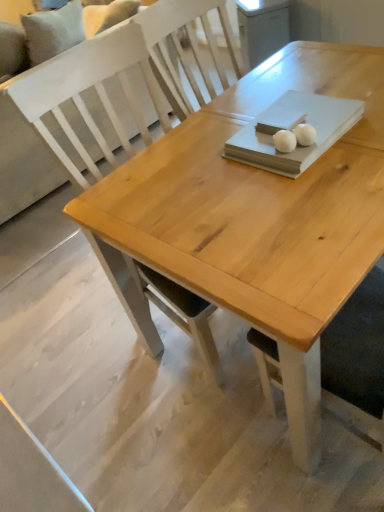
You are a GUI agent. You are given a task and a screenshot of the screen. Output one action in this format:
    pyautogui.click(x=<x>, y=<y>)
    Task: Click on the natural wood table at center
    This screenshot has height=512, width=384.
    Given the screenshot: What is the action you would take?
    pyautogui.click(x=255, y=220)

The image size is (384, 512). Describe the element at coordinates (284, 141) in the screenshot. I see `white matte ball at center, the second food viewed from the right` at that location.

Locate an element on the screen. The height and width of the screenshot is (512, 384). white glossy egg at upper center, arranged as the second food when viewed from the left is located at coordinates (305, 134).

From a real-world perspective, is white fabric couch at upper left physically located above or below white matte ball at center, which is the 1th food in left-to-right order?

white fabric couch at upper left is below white matte ball at center, which is the 1th food in left-to-right order.

Which is more to the right, white fabric couch at upper left or white matte ball at center, which is the 1th food in left-to-right order?

white matte ball at center, which is the 1th food in left-to-right order, is more to the right.

How different are the orientations of white fabric couch at upper left and white matte ball at center, the second food viewed from the right, in degrees?

There is a 23-degree angle between the facing directions of white fabric couch at upper left and white matte ball at center, the second food viewed from the right.

Can you confirm if white fabric couch at upper left is taller than white matte ball at center, the second food viewed from the right?

Correct, white fabric couch at upper left is much taller as white matte ball at center, the second food viewed from the right.

Locate an element on the screen. Image resolution: width=384 pixels, height=512 pixels. couch on the left of white glossy egg at upper center, arranged as the 1th food when viewed from the right is located at coordinates (22, 163).

Would you say white fabric couch at upper left is part of white glossy egg at upper center, arranged as the second food when viewed from the left,'s contents?

No, white glossy egg at upper center, arranged as the second food when viewed from the left, does not contain white fabric couch at upper left.

Can you confirm if white glossy egg at upper center, arranged as the second food when viewed from the left, is positioned to the left of white fabric couch at upper left?

No, white glossy egg at upper center, arranged as the second food when viewed from the left, is not to the left of white fabric couch at upper left.

Between white glossy egg at upper center, arranged as the 1th food when viewed from the right, and white fabric couch at upper left, which one is positioned behind?

white fabric couch at upper left is behind.

Identify the location of table above the white glossy egg at upper center, arranged as the second food when viewed from the left (from the image's perspective). The width and height of the screenshot is (384, 512). (255, 220).

What's the angular difference between white glossy egg at upper center, arranged as the second food when viewed from the left, and natural wood table at center's facing directions?

23.1 degrees separate the facing orientations of white glossy egg at upper center, arranged as the second food when viewed from the left, and natural wood table at center.

Do you think white glossy egg at upper center, arranged as the 1th food when viewed from the right, is within natural wood table at center, or outside of it?

white glossy egg at upper center, arranged as the 1th food when viewed from the right, is outside natural wood table at center.

Is white glossy egg at upper center, arranged as the second food when viewed from the left, positioned with its back to natural wood table at center?

white glossy egg at upper center, arranged as the second food when viewed from the left, does not have its back to natural wood table at center.

Locate an element on the screen. The height and width of the screenshot is (512, 384). couch behind the natural wood table at center is located at coordinates (22, 163).

Which is more to the right, white fabric couch at upper left or natural wood table at center?

natural wood table at center.

Does white fabric couch at upper left have a greater height compared to natural wood table at center?

Yes, white fabric couch at upper left is taller than natural wood table at center.

Considering the relative sizes of white matte ball at center, which is the 1th food in left-to-right order, and white fabric couch at upper left in the image provided, is white matte ball at center, which is the 1th food in left-to-right order, taller than white fabric couch at upper left?

In fact, white matte ball at center, which is the 1th food in left-to-right order, may be shorter than white fabric couch at upper left.

Is point (286, 148) less distant than point (55, 130)?

Yes.

Is white matte ball at center, which is the 1th food in left-to-right order, bigger than white fabric couch at upper left?

Incorrect, white matte ball at center, which is the 1th food in left-to-right order, is not larger than white fabric couch at upper left.

In the scene shown: Is white matte ball at center, the second food viewed from the right, inside the boundaries of white fabric couch at upper left, or outside?

white matte ball at center, the second food viewed from the right, exists outside the volume of white fabric couch at upper left.

How many degrees apart are the facing directions of natural wood table at center and white matte ball at center, the second food viewed from the right?

The facing directions of natural wood table at center and white matte ball at center, the second food viewed from the right, are 23.1 degrees apart.

Considering the relative sizes of natural wood table at center and white matte ball at center, which is the 1th food in left-to-right order, in the image provided, is natural wood table at center shorter than white matte ball at center, which is the 1th food in left-to-right order,?

In fact, natural wood table at center may be taller than white matte ball at center, which is the 1th food in left-to-right order.

From the image's perspective, who appears lower, natural wood table at center or white matte ball at center, which is the 1th food in left-to-right order?

white matte ball at center, which is the 1th food in left-to-right order.

Considering the sizes of objects natural wood table at center and white matte ball at center, which is the 1th food in left-to-right order, in the image provided, who is smaller, natural wood table at center or white matte ball at center, which is the 1th food in left-to-right order,?

With smaller size is white matte ball at center, which is the 1th food in left-to-right order.

Is white matte ball at center, the second food viewed from the right, surrounding natural wood table at center?

Definitely not — natural wood table at center is not inside white matte ball at center, the second food viewed from the right.

Is point (280, 138) behind point (299, 305)?

Yes, it is.

Does white matte ball at center, which is the 1th food in left-to-right order, turn towards natural wood table at center?

No, white matte ball at center, which is the 1th food in left-to-right order, is not turned towards natural wood table at center.

At what (x,y) coordinates should I click in order to perform the action: click on the 2nd food located above the white fabric couch at upper left (from a real-world perspective). Please return your answer as a coordinate pair (x, y). Looking at the image, I should click on (284, 141).

Find the location of a particular element. This screenshot has width=384, height=512. couch above the white glossy egg at upper center, arranged as the second food when viewed from the left (from the image's perspective) is located at coordinates (22, 163).

Estimate the real-world distances between objects in this image. Which object is closer to white matte ball at center, the second food viewed from the right, white fabric couch at upper left or white glossy egg at upper center, arranged as the second food when viewed from the left?

white glossy egg at upper center, arranged as the second food when viewed from the left, is closer to white matte ball at center, the second food viewed from the right.

Consider the image. Looking at the image, which one is located closer to white matte ball at center, the second food viewed from the right, natural wood table at center or white glossy egg at upper center, arranged as the 1th food when viewed from the right?

white glossy egg at upper center, arranged as the 1th food when viewed from the right, lies closer to white matte ball at center, the second food viewed from the right, than the other object.

From the image, which object appears to be farther from natural wood table at center, white matte ball at center, which is the 1th food in left-to-right order, or white fabric couch at upper left?

Based on the image, white fabric couch at upper left appears to be further to natural wood table at center.

Considering their positions, is white matte ball at center, the second food viewed from the right, positioned closer to white fabric couch at upper left than natural wood table at center?

Among the two, natural wood table at center is located nearer to white fabric couch at upper left.

Estimate the real-world distances between objects in this image. Which object is closer to white matte ball at center, which is the 1th food in left-to-right order, white glossy egg at upper center, arranged as the 1th food when viewed from the right, or white fabric couch at upper left?

white glossy egg at upper center, arranged as the 1th food when viewed from the right.

From the image, which object appears to be farther from white matte ball at center, which is the 1th food in left-to-right order, white glossy egg at upper center, arranged as the second food when viewed from the left, or natural wood table at center?

natural wood table at center.

When comparing their distances from white glossy egg at upper center, arranged as the 1th food when viewed from the right, does white fabric couch at upper left or natural wood table at center seem further?

Among the two, white fabric couch at upper left is located further to white glossy egg at upper center, arranged as the 1th food when viewed from the right.

When comparing their distances from natural wood table at center, does white glossy egg at upper center, arranged as the second food when viewed from the left, or white fabric couch at upper left seem closer?

white glossy egg at upper center, arranged as the second food when viewed from the left, lies closer to natural wood table at center than the other object.

Where is `table located between white fabric couch at upper left and white glossy egg at upper center, arranged as the second food when viewed from the left, in the left-right direction`? table located between white fabric couch at upper left and white glossy egg at upper center, arranged as the second food when viewed from the left, in the left-right direction is located at coordinates (255, 220).

Image resolution: width=384 pixels, height=512 pixels. Find the location of `food between natural wood table at center and white glossy egg at upper center, arranged as the 1th food when viewed from the right, in the horizontal direction`. food between natural wood table at center and white glossy egg at upper center, arranged as the 1th food when viewed from the right, in the horizontal direction is located at coordinates (284, 141).

Where is `table between white fabric couch at upper left and white matte ball at center, which is the 1th food in left-to-right order`? Image resolution: width=384 pixels, height=512 pixels. table between white fabric couch at upper left and white matte ball at center, which is the 1th food in left-to-right order is located at coordinates (255, 220).

You are a GUI agent. You are given a task and a screenshot of the screen. Output one action in this format:
    pyautogui.click(x=<x>, y=<y>)
    Task: Click on the food between white fabric couch at upper left and white glossy egg at upper center, arranged as the second food when viewed from the left, in the horizontal direction
    The height and width of the screenshot is (512, 384).
    Given the screenshot: What is the action you would take?
    pyautogui.click(x=284, y=141)